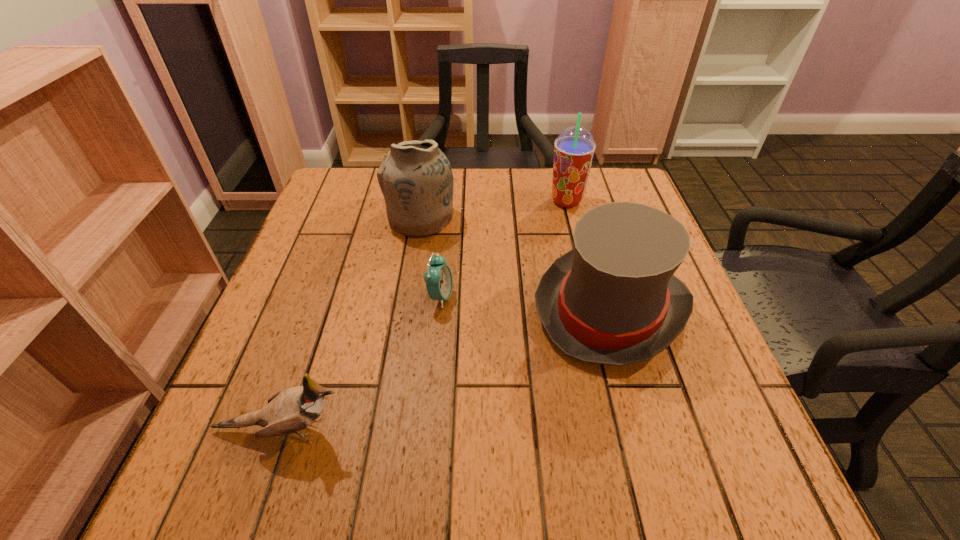
In the image, there is a desktop. Where is `blank space at the near edge`? blank space at the near edge is located at coordinates (516, 456).

At what (x,y) coordinates should I click in order to perform the action: click on free space at the left edge of the desktop. Please return your answer as a coordinate pair (x, y). Image resolution: width=960 pixels, height=540 pixels. Looking at the image, I should click on (322, 258).

Image resolution: width=960 pixels, height=540 pixels. Identify the location of free space at the far left corner of the desktop. (336, 217).

This screenshot has height=540, width=960. I want to click on vacant space at the near left corner of the desktop, so click(191, 489).

Where is `vacant space at the far right corner`? vacant space at the far right corner is located at coordinates (613, 193).

Where is `free space that is in between the alarm clock and the nearest object`? The width and height of the screenshot is (960, 540). free space that is in between the alarm clock and the nearest object is located at coordinates (361, 363).

This screenshot has height=540, width=960. What are the coordinates of `free spot between the dress hat and the pottery` in the screenshot? It's located at (516, 263).

Find the location of a particular element. Image resolution: width=960 pixels, height=540 pixels. free space between the pottery and the smoothie is located at coordinates (493, 209).

Identify the location of vacant space in between the dress hat and the shortest object. The width and height of the screenshot is (960, 540). (525, 303).

Find the location of `vacant space in between the third tallest object and the second shortest object`. vacant space in between the third tallest object and the second shortest object is located at coordinates (446, 369).